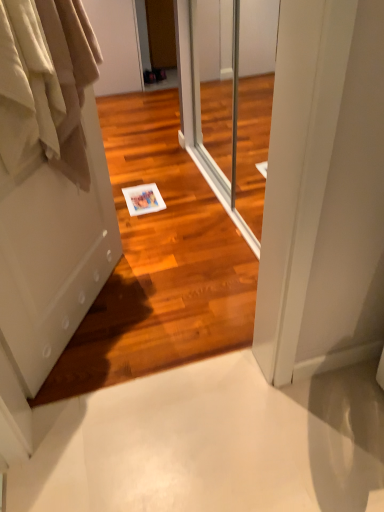
Where is `vacant space in front of transparent glass screen door at center`? This screenshot has width=384, height=512. vacant space in front of transparent glass screen door at center is located at coordinates (189, 268).